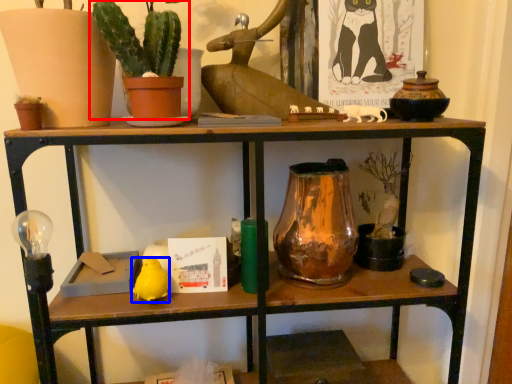
Question: Which object is closer to the camera taking this photo, houseplant (highlighted by a red box) or animal (highlighted by a blue box)?

Choices:
 (A) houseplant
 (B) animal

Answer: (A)